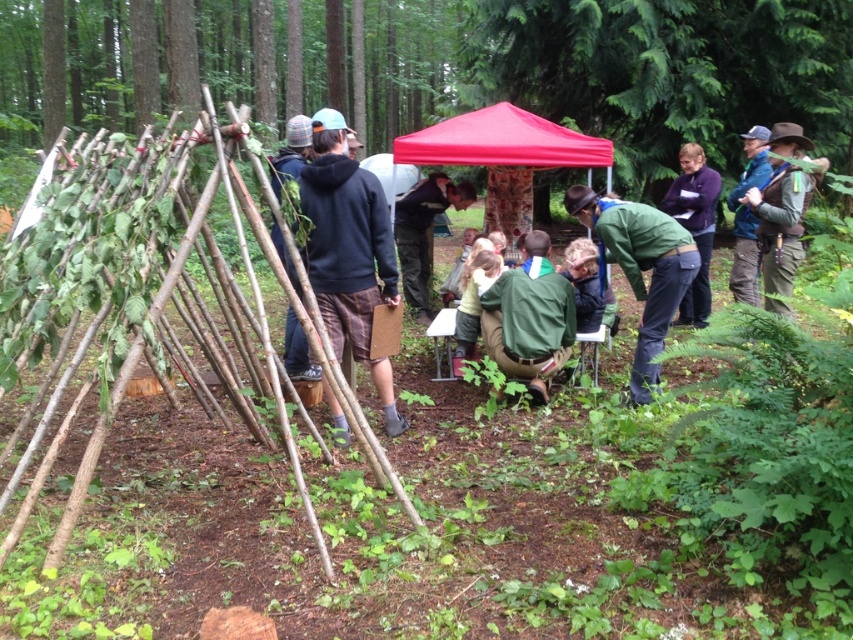
Looking at this image, you are a hiker who needs to set up a tent. You have a red fabric tent at center and a dark purple sweater at center. How far apart are these two items from each other?

The red fabric tent at center and the dark purple sweater at center are 1.26 meters apart.

You are standing in the forest and see the red fabric tent at center and the dark purple sweater at center. Which object is nearer to you?

The red fabric tent at center is closer to the viewer than the dark purple sweater at center.